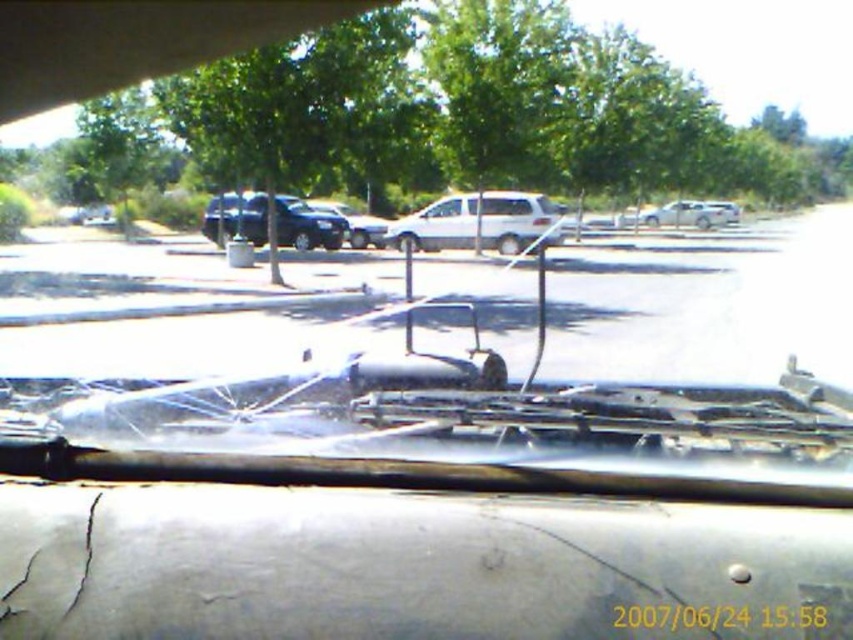
Question: Which object is positioned farthest from the satin black suv at center?

Choices:
 (A) white matte car at center
 (B) shiny black car at center

Answer: (A)

Question: Which point appears closest to the camera in this image?

Choices:
 (A) (544, 202)
 (B) (329, 208)

Answer: (A)

Question: Can you confirm if white matte car at center is smaller than white matte suv at center?

Choices:
 (A) yes
 (B) no

Answer: (B)

Question: Can you confirm if satin black suv at center is positioned to the left of white matte suv at center?

Choices:
 (A) no
 (B) yes

Answer: (B)

Question: Which point is closer to the camera taking this photo?

Choices:
 (A) (352, 220)
 (B) (653, 323)
 (C) (495, 214)

Answer: (B)

Question: Does white matte van at center lie in front of satin black suv at center?

Choices:
 (A) no
 (B) yes

Answer: (A)